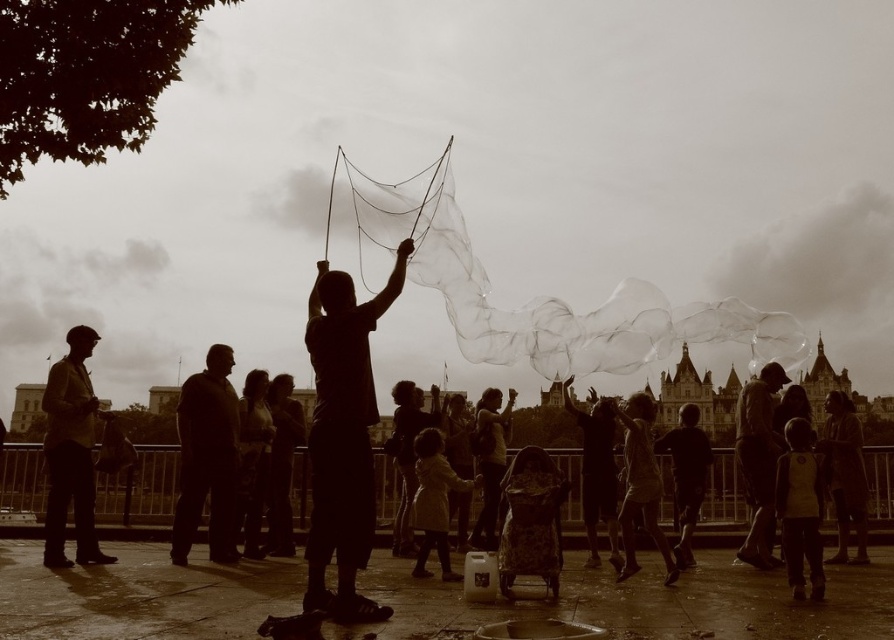
Question: Can you confirm if dark brown leather jacket at center is positioned above matte white dress at center?

Choices:
 (A) no
 (B) yes

Answer: (B)

Question: Which object appears farthest from the camera in this image?

Choices:
 (A) matte brown jacket at left
 (B) light beige coat at center

Answer: (A)

Question: Among these points, which one is nearest to the camera?

Choices:
 (A) (789, 323)
 (B) (447, 468)
 (C) (665, 582)
 (D) (740, 435)

Answer: (C)

Question: Based on their relative distances, which object is farther from the dark brown leather jacket at center?

Choices:
 (A) light yellow fabric shirt at lower right
 (B) matte white dress at center

Answer: (A)

Question: Is dark brown leather jacket at center above light yellow fabric shirt at lower right?

Choices:
 (A) yes
 (B) no

Answer: (A)

Question: Does dark brown leather jacket at center appear over light beige coat at center?

Choices:
 (A) yes
 (B) no

Answer: (A)